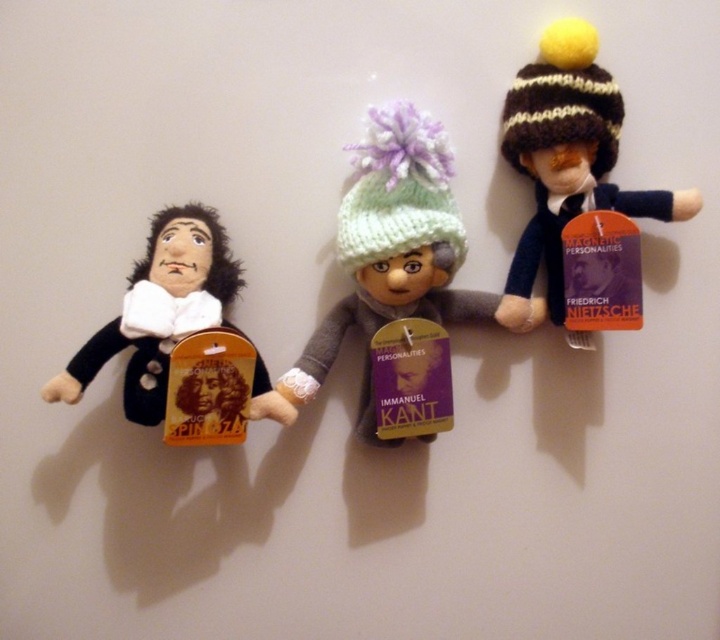
You are organizing a display for the Magnetic Personalities series. You have a shelf that can only accommodate items up to 12 inches wide. The knitted green hat at center and the velvet black doll at left need to be placed on this shelf. Which item should you place first to ensure both fit?

The velvet black doll at left should be placed first because its width is smaller than the knitted green hat at center, allowing both items to fit within the 12 inch limit.

You are a collector who wants to display the knitted woolen hat at upper right and the velvet black doll at left on a shelf. Which object should you place first to ensure both fit on the shelf?

The knitted woolen hat at upper right is much taller than the velvet black doll at left, so you should place the knitted woolen hat at upper right first to ensure both fit on the shelf.